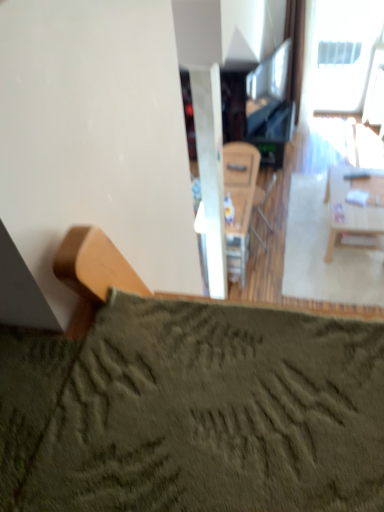
Question: From the image's perspective, is wooden armchair at center located above or below white plastic window at upper right?

Choices:
 (A) below
 (B) above

Answer: (A)

Question: Considering the positions of point (249, 222) and point (360, 45), is point (249, 222) closer or farther from the camera than point (360, 45)?

Choices:
 (A) farther
 (B) closer

Answer: (B)

Question: Estimate the real-world distances between objects in this image. Which object is farther from the white plastic window at upper right?

Choices:
 (A) wooden armchair at center
 (B) light wood table at right

Answer: (B)

Question: Which of these objects is positioned closest to the light wood table at right?

Choices:
 (A) white plastic window at upper right
 (B) wooden armchair at center

Answer: (B)